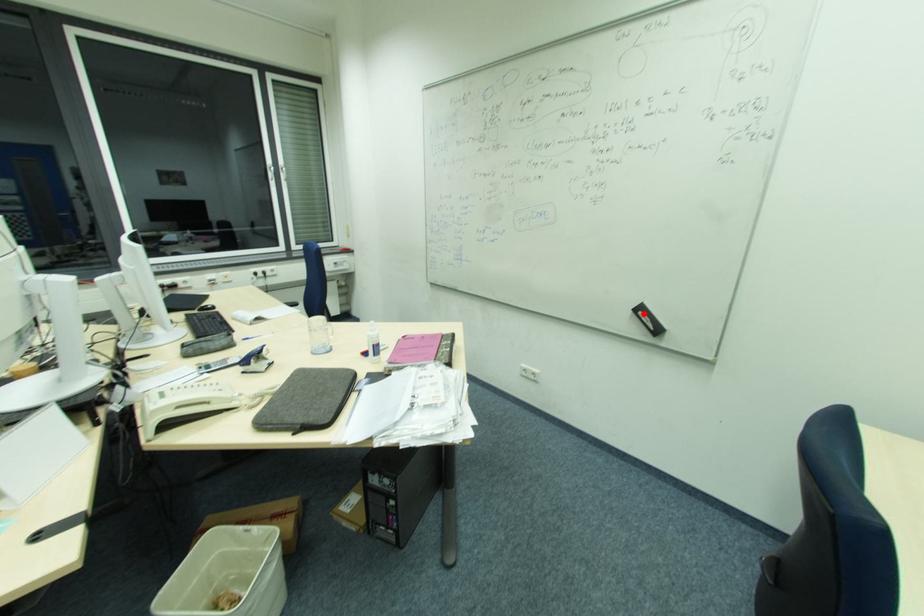
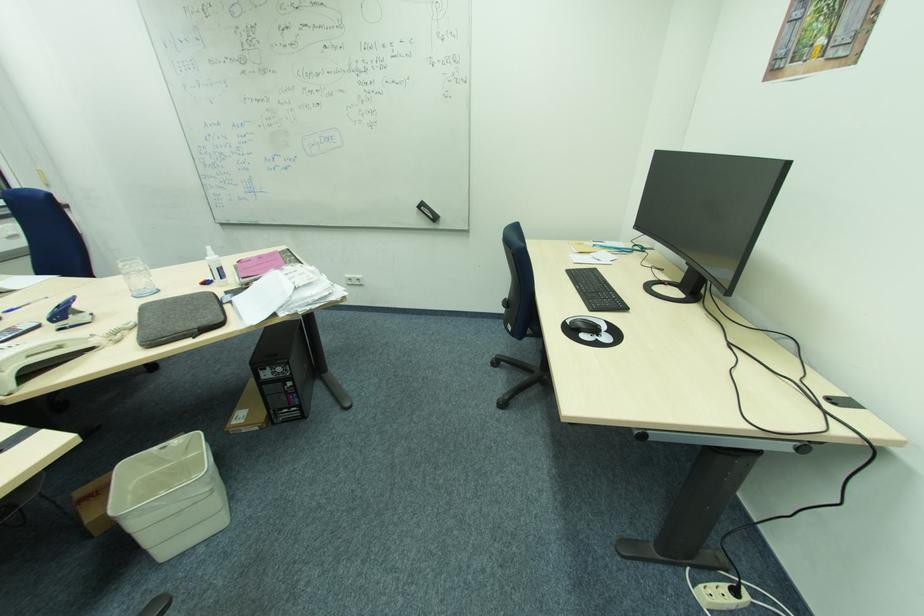
Where in the second image is the point corresponding to the highlighted location from the first image?

(426, 208)